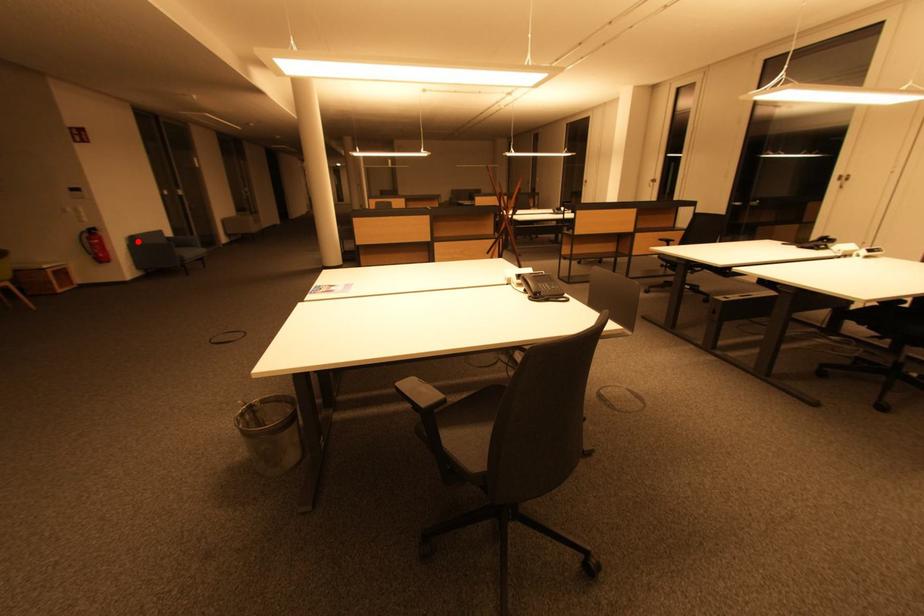
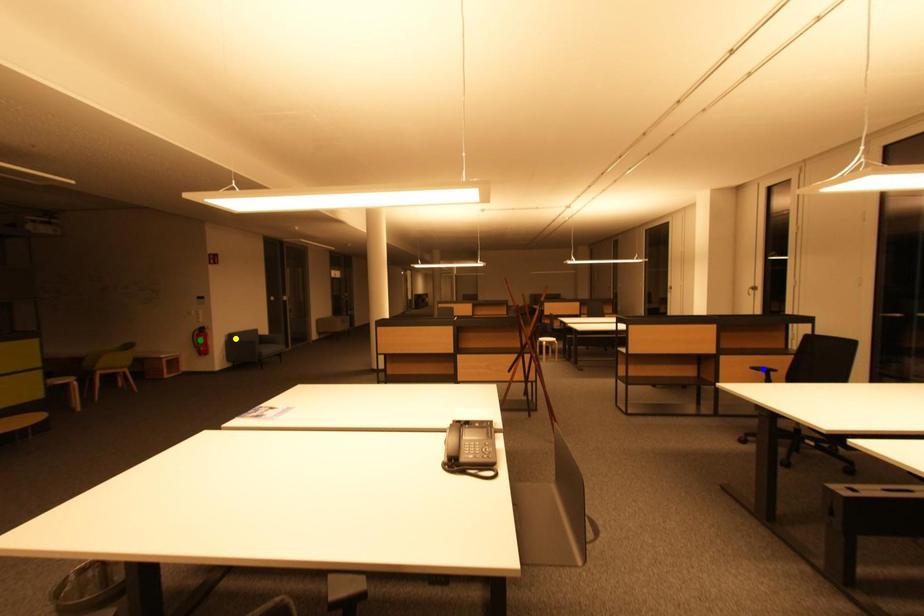
Question: I am providing you with two images of the same scene from different viewpoints. A red point is marked on the first image. You are given multiple points on the second image. Which mark in image 2 goes with the point in image 1?

Choices:
 (A) yellow point
 (B) blue point
 (C) green point

Answer: (A)